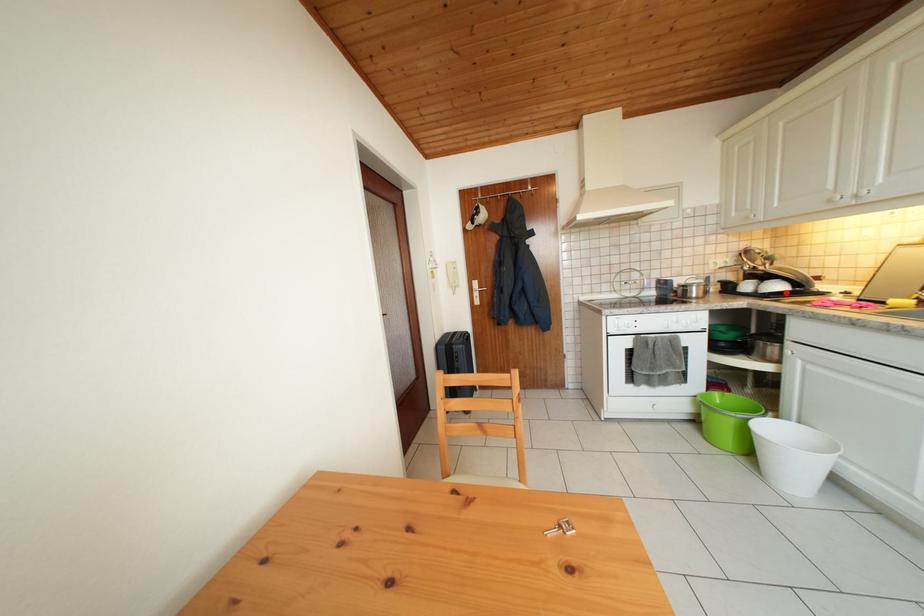
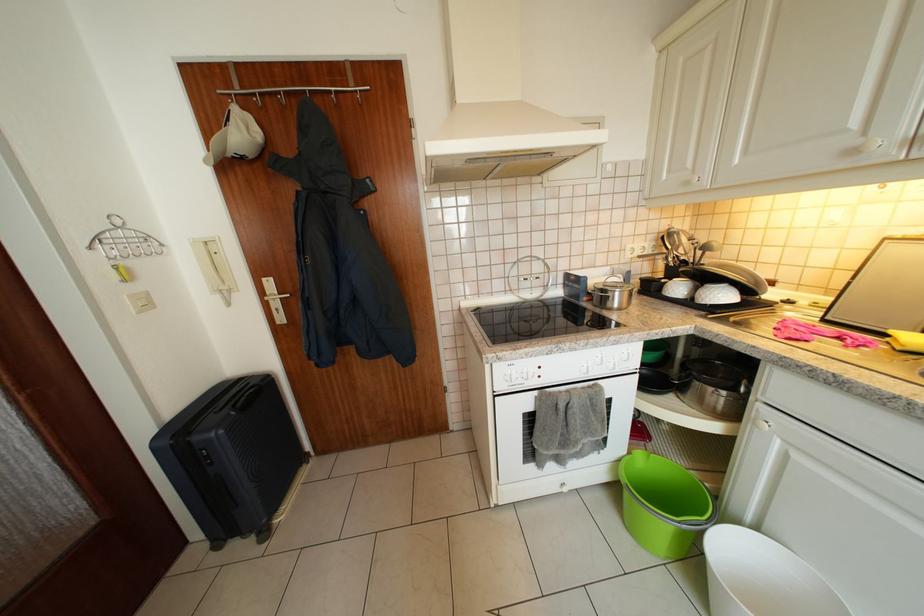
The point at the highlighted location is marked in the first image. Where is the corresponding point in the second image?

(730, 300)